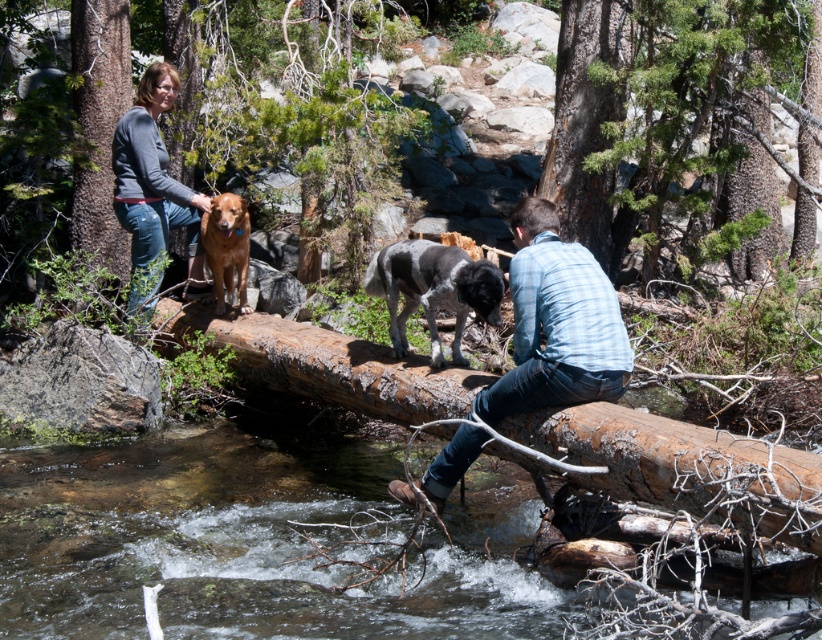
Question: Does brown rough log at center come behind brown rough bark at left?

Choices:
 (A) yes
 (B) no

Answer: (B)

Question: Based on their relative distances, which object is nearer to the matte gray sweater at upper left?

Choices:
 (A) gray and white fur dog at center
 (B) clear water at log right

Answer: (B)

Question: Is brown rough log at center thinner than brown rough bark tree trunk at center?

Choices:
 (A) no
 (B) yes

Answer: (B)

Question: Which point is farther to the camera?

Choices:
 (A) blue plaid shirt at center
 (B) gray and white fur dog at center
 (C) matte gray sweater at upper left
 (D) brown rough tree trunk at center-right

Answer: (D)

Question: Which object is positioned closest to the brown rough bark at left?

Choices:
 (A) matte gray sweater at upper left
 (B) blue plaid shirt at center
 (C) brown rough tree trunk at center-right
 (D) green rough bark tree at center

Answer: (A)

Question: Is brown rough log at center wider than brown rough bark at left?

Choices:
 (A) no
 (B) yes

Answer: (A)